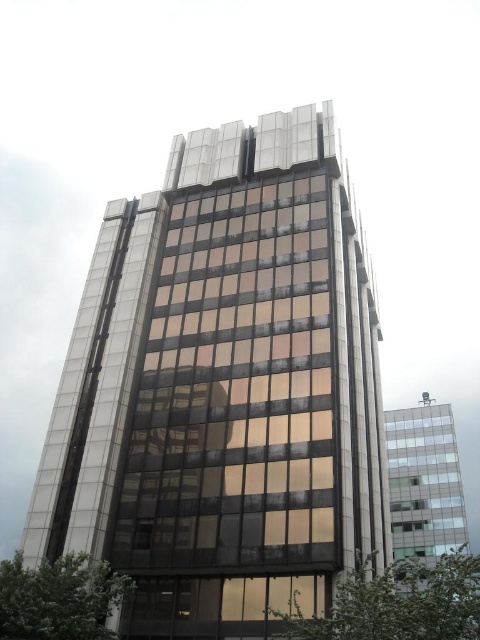
Does glassy reflective building at center appear on the left side of clear glass building at right?

Indeed, glassy reflective building at center is positioned on the left side of clear glass building at right.

Can you confirm if glassy reflective building at center is positioned to the right of clear glass building at right?

No, glassy reflective building at center is not to the right of clear glass building at right.

Which is behind, point (229, 420) or point (455, 452)?

The point (455, 452) is behind.

Where is `glassy reflective building at center`? The height and width of the screenshot is (640, 480). glassy reflective building at center is located at coordinates (224, 388).